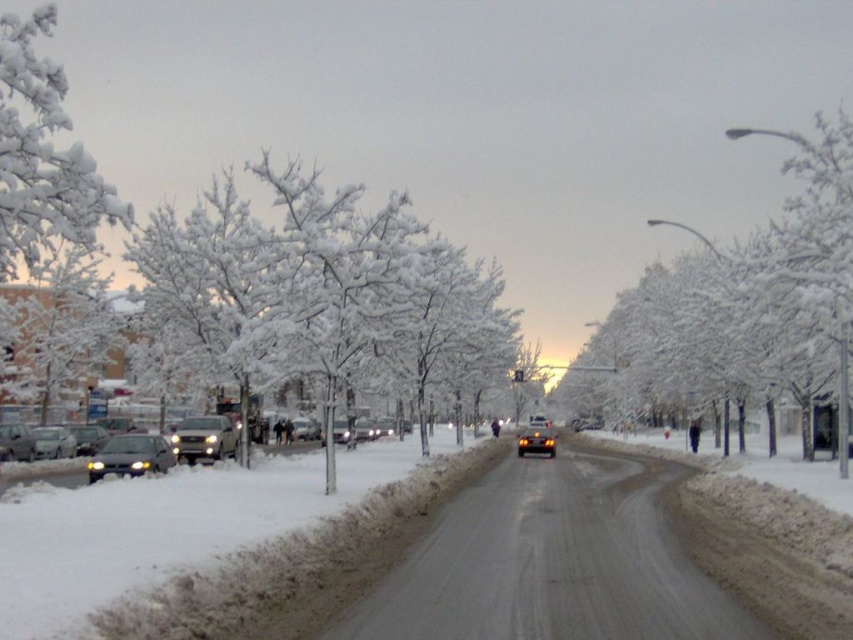
Question: Does white snow-covered tree at right have a greater width compared to matte silver sedan at left?

Choices:
 (A) no
 (B) yes

Answer: (B)

Question: Is white snow-covered tree at right to the right of matte silver sedan at left from the viewer's perspective?

Choices:
 (A) yes
 (B) no

Answer: (A)

Question: Which of these objects is positioned farthest from the white frosty tree at upper left?

Choices:
 (A) white snow-covered tree at right
 (B) satin silver suv at left
 (C) shiny silver sedan at left

Answer: (A)

Question: Which point is closer to the camera?

Choices:
 (A) pos(532,435)
 (B) pos(196,433)

Answer: (B)

Question: Based on their relative distances, which object is farther from the white frosty tree at upper left?

Choices:
 (A) shiny silver car at center
 (B) shiny silver sedan at left

Answer: (A)

Question: Can you confirm if shiny silver sedan at left is positioned below shiny silver car at center?

Choices:
 (A) no
 (B) yes

Answer: (A)